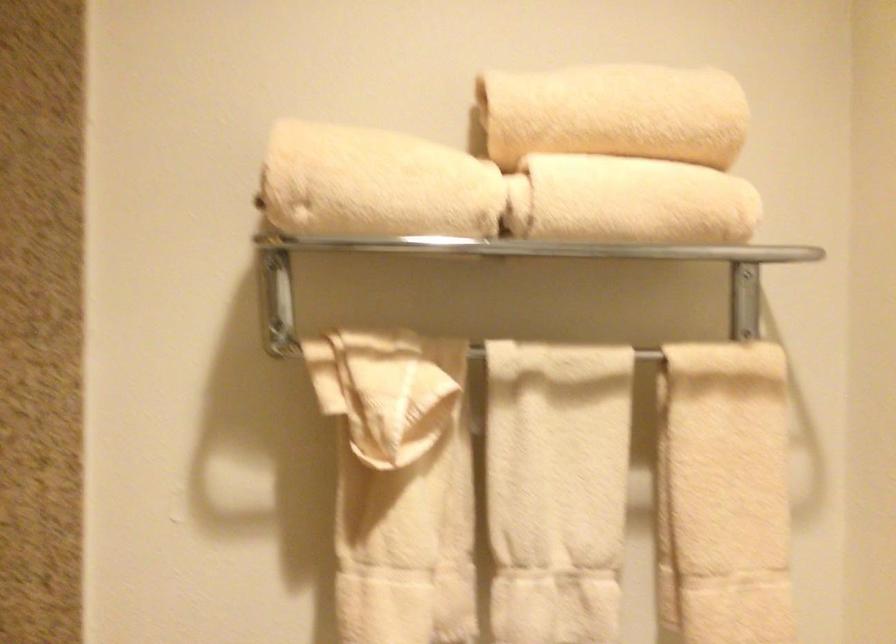
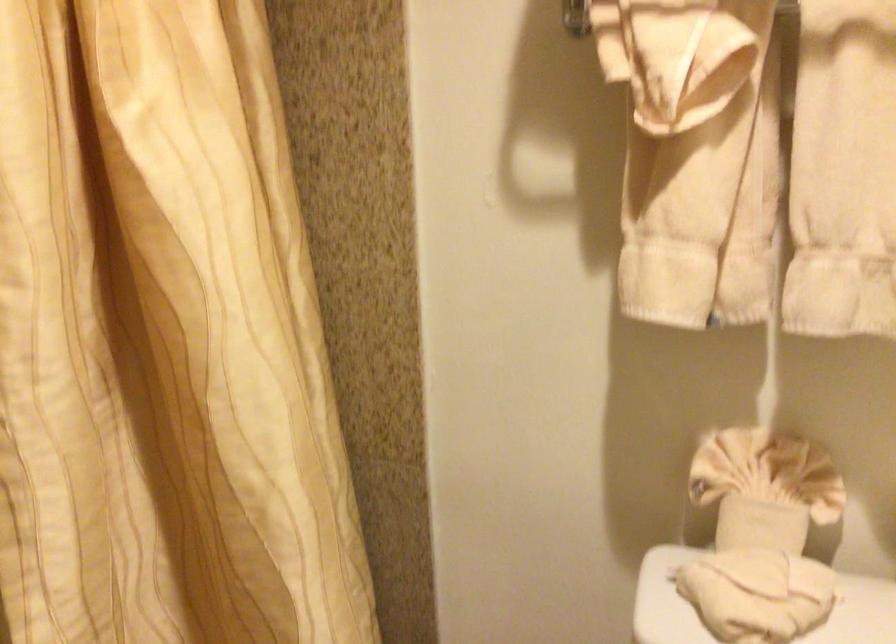
How did the camera likely rotate?

The camera's rotation is toward left-down.